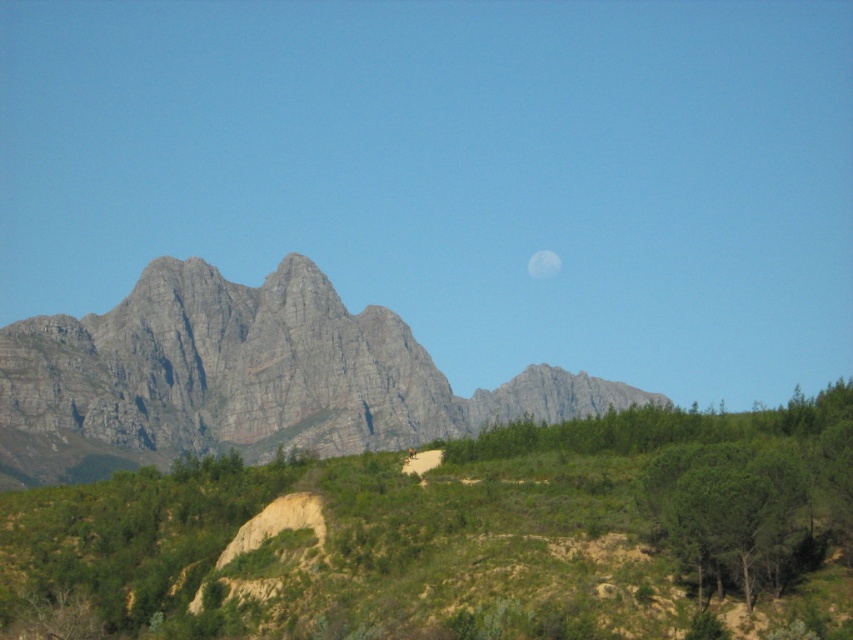
You are standing at the base of the gray rock mountain at upper left marked by point (244, 378). Looking towards the mountains, which direction should you go to find the sandy path or trail winding through the hill?

The sandy path or trail winding through the hill is located in the foreground, so you should go towards the foreground direction from the gray rock mountain at upper left marked by point (244, 378).

You are an astronaut on the moon, and you see the green leafy tree at lower right and the white matte moon at upper center in the image. Which object is taller?

The green leafy tree at lower right is not as tall as the white matte moon at upper center, so the white matte moon at upper center is taller.